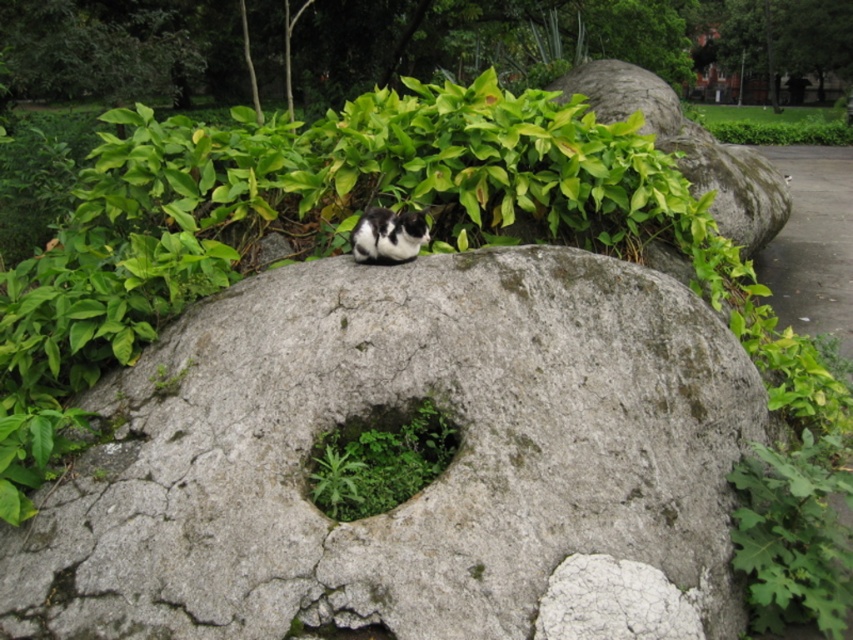
Which is more to the right, green mossy hole at center or black-and-white fur cat at center?

Positioned to the right is green mossy hole at center.

Does green mossy hole at center have a lesser width compared to black-and-white fur cat at center?

In fact, green mossy hole at center might be wider than black-and-white fur cat at center.

Does point (345, 467) come closer to viewer compared to point (399, 227)?

Yes, it is in front of point (399, 227).

Identify the location of green mossy hole at center. (379, 461).

Based on the photo, is gray rough boulder at center wider than green mossy hole at center?

Correct, the width of gray rough boulder at center exceeds that of green mossy hole at center.

Describe the element at coordinates (428, 484) in the screenshot. I see `gray rough boulder at center` at that location.

The image size is (853, 640). Identify the location of gray rough boulder at center. (428, 484).

Which is below, gray rough boulder at center or black-and-white fur cat at center?

gray rough boulder at center

Is point (654, 493) farther from viewer compared to point (387, 257)?

That is False.

Locate an element on the screen. The height and width of the screenshot is (640, 853). gray rough boulder at center is located at coordinates pos(428,484).